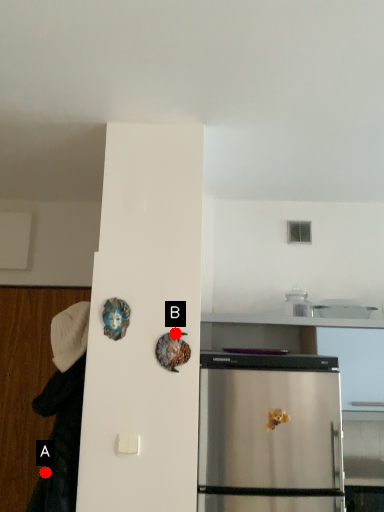
Question: Two points are circled on the image, labeled by A and B beside each circle. Which of the following is the farthest from the observer?

Choices:
 (A) A is further
 (B) B is further

Answer: (B)